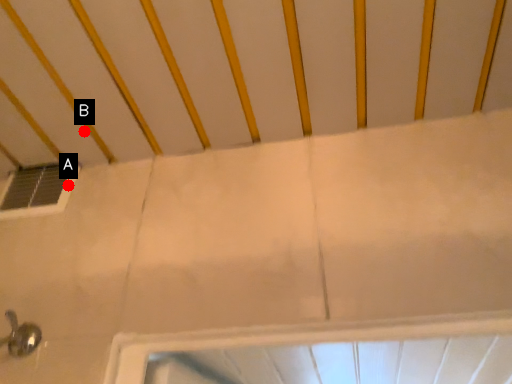
Question: Two points are circled on the image, labeled by A and B beside each circle. Which point is farther to the camera?

Choices:
 (A) A is further
 (B) B is further

Answer: (A)